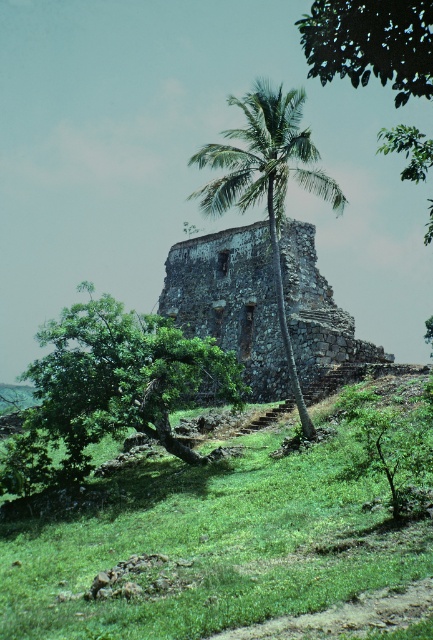
What do you see at coordinates (267, 180) in the screenshot?
I see `green leafy palm at center` at bounding box center [267, 180].

Is point (254, 100) less distant than point (378, 147)?

Yes, it is.

Find the location of `green leafy palm at center`. green leafy palm at center is located at coordinates (267, 180).

Where is `green leafy tree at center`? This screenshot has height=640, width=433. green leafy tree at center is located at coordinates (110, 387).

You are a GUI agent. You are given a task and a screenshot of the screen. Output one action in this format:
    pyautogui.click(x=<x>, y=<y>)
    Task: Click on the green leafy tree at center
    The image size is (433, 640).
    Given the screenshot: What is the action you would take?
    pyautogui.click(x=110, y=387)

Is green grassy at center above rusty stone ruins at center?

Incorrect, green grassy at center is not positioned above rusty stone ruins at center.

Between green grassy at center and rusty stone ruins at center, which one has more height?

With more height is rusty stone ruins at center.

I want to click on green grassy at center, so click(x=209, y=541).